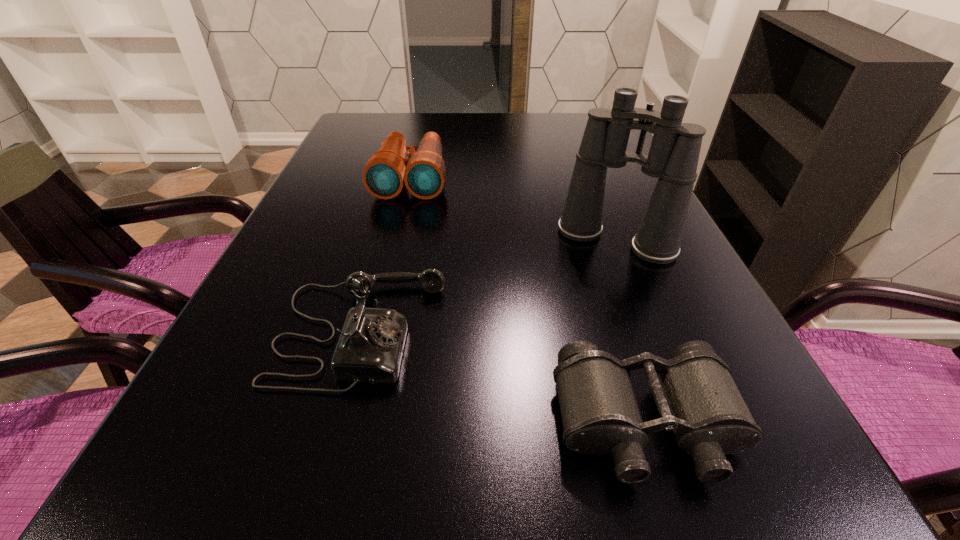
You are a GUI agent. You are given a task and a screenshot of the screen. Output one action in this format:
    pyautogui.click(x=<x>, y=<y>)
    Task: Click on the free space at the far right corner of the desktop
    This screenshot has width=960, height=540.
    Given the screenshot: What is the action you would take?
    coord(573,119)

Image resolution: width=960 pixels, height=540 pixels. Find the location of `free space between the leftmost binoculars and the second farthest object`. free space between the leftmost binoculars and the second farthest object is located at coordinates (514, 209).

The image size is (960, 540). I want to click on free spot between the telephone and the farthest binoculars, so click(386, 255).

You are a GUI agent. You are given a task and a screenshot of the screen. Output one action in this format:
    pyautogui.click(x=<x>, y=<y>)
    Task: Click on the vacant area that lies between the tallest object and the farthest object
    
    Given the screenshot: What is the action you would take?
    pyautogui.click(x=514, y=209)

Locate an element on the screen. free space between the leftmost binoculars and the tallest object is located at coordinates (514, 209).

At what (x,y) coordinates should I click in order to perform the action: click on free space between the farthest object and the second nearest binoculars. Please return your answer as a coordinate pair (x, y). Looking at the image, I should click on (514, 209).

The width and height of the screenshot is (960, 540). I want to click on unoccupied position between the shortest binoculars and the tallest object, so click(x=631, y=332).

The width and height of the screenshot is (960, 540). I want to click on unoccupied position between the nearest binoculars and the leftmost binoculars, so click(529, 301).

This screenshot has width=960, height=540. Find the location of `vacant area that lies between the shortest binoculars and the second shortest binoculars`. vacant area that lies between the shortest binoculars and the second shortest binoculars is located at coordinates (529, 301).

Locate an element on the screen. vacant region between the shortest object and the third nearest object is located at coordinates (631, 332).